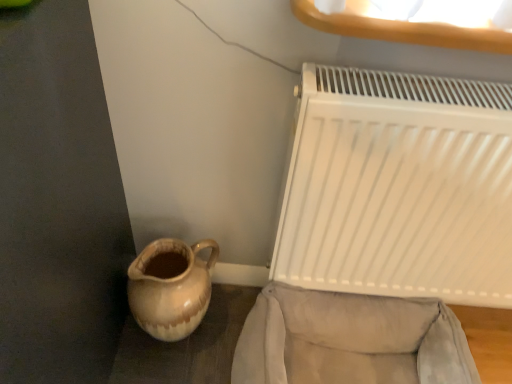
Question: In terms of height, does velvet beige armchair at lower right look taller or shorter compared to brown glazed jug at lower left?

Choices:
 (A) short
 (B) tall

Answer: (A)

Question: From a real-world perspective, relative to brown glazed jug at lower left, is velvet beige armchair at lower right vertically above or below?

Choices:
 (A) above
 (B) below

Answer: (B)

Question: Which object is the closest to the velvet beige armchair at lower right?

Choices:
 (A) white matte radiator at right
 (B) brown glazed jug at lower left

Answer: (A)

Question: Based on their relative distances, which object is farther from the velvet beige armchair at lower right?

Choices:
 (A) brown glazed jug at lower left
 (B) white matte radiator at right

Answer: (A)